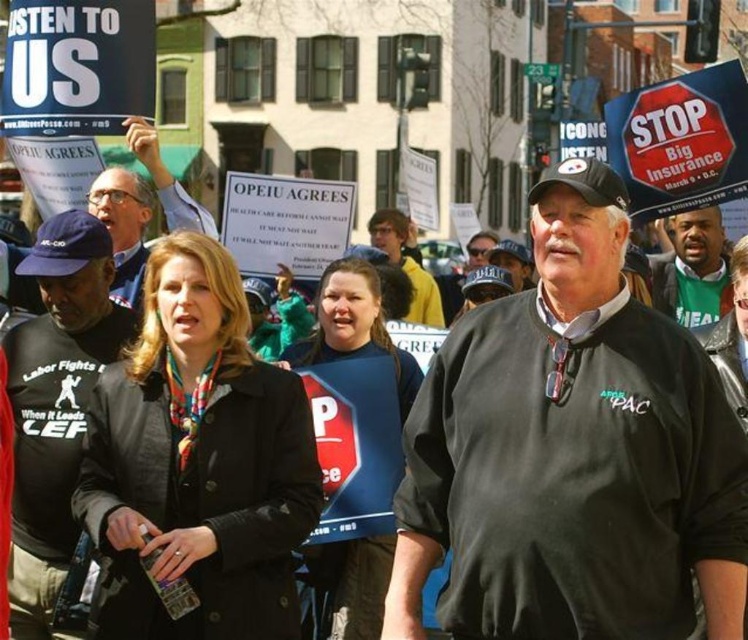
In the image of the protest scene, there is a black jacket at center and a woman with long. Which object is located at the coordinate point (x=123, y=227)?

The black jacket at center is represented by point (x=123, y=227).